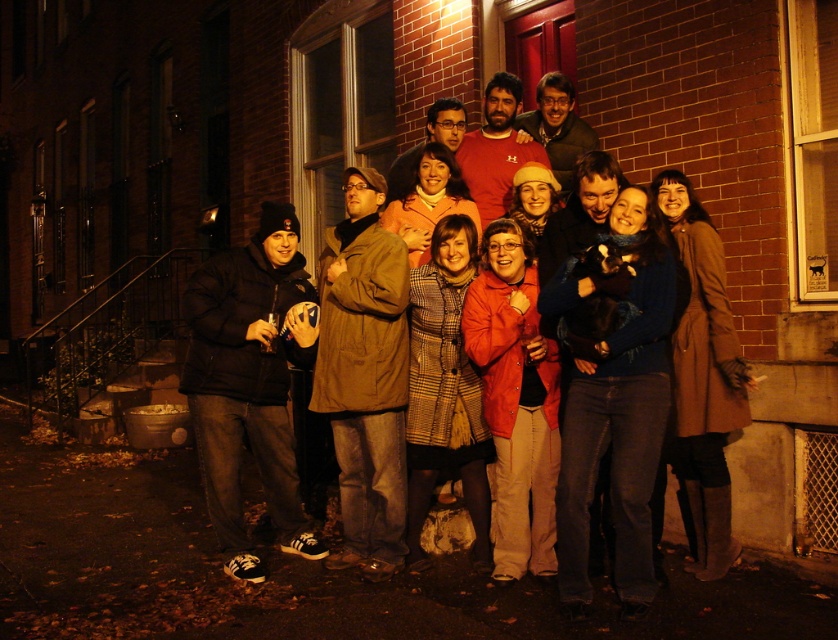
Does black matte jacket at left appear on the left side of brown matte coat at center?

Correct, you'll find black matte jacket at left to the left of brown matte coat at center.

From the picture: Who is more distant from viewer, (220, 500) or (345, 419)?

The point (345, 419) is behind.

Find the location of a particular element. Image resolution: width=838 pixels, height=640 pixels. black matte jacket at left is located at coordinates (249, 381).